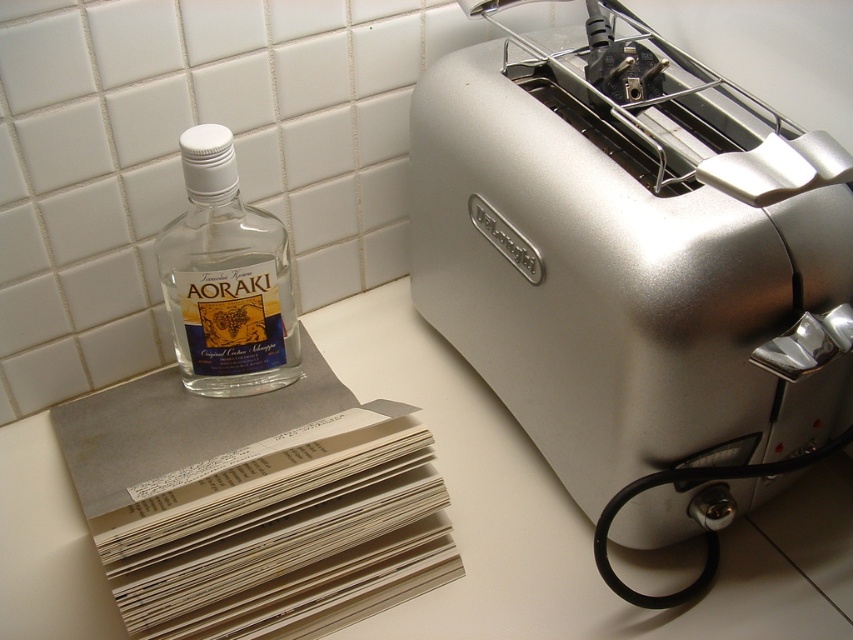
Is the position of satin silver toaster at right more distant than that of transparent glass bottle at left?

No, it is in front of transparent glass bottle at left.

Measure the distance from satin silver toaster at right to transparent glass bottle at left.

satin silver toaster at right and transparent glass bottle at left are 28.51 centimeters apart.

Where is `satin silver toaster at right`? The image size is (853, 640). satin silver toaster at right is located at coordinates (630, 253).